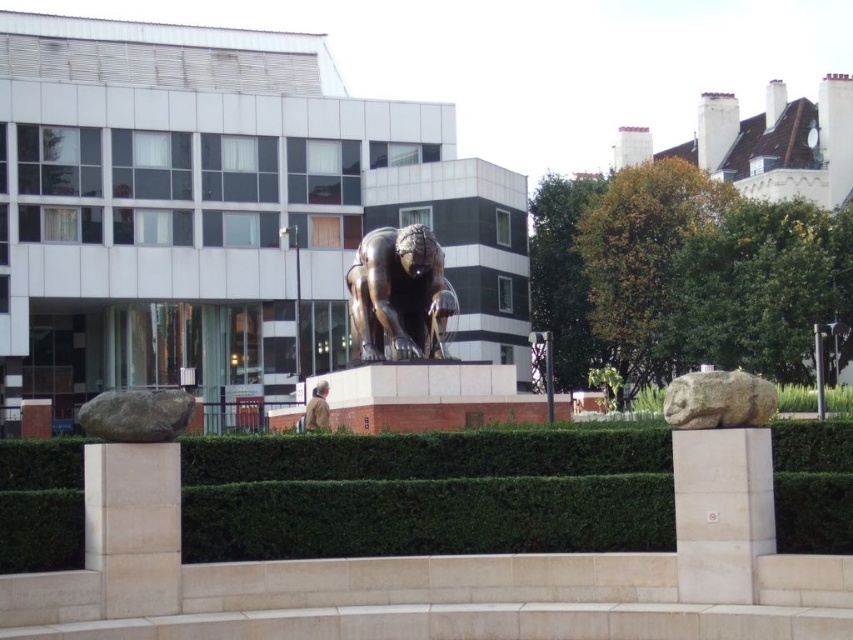
Question: Which is nearer to the green hedge at center?

Choices:
 (A) green mossy stone at center
 (B) gray rough rock at lower left
 (C) bronze statue at center
 (D) green leafy bush at upper right

Answer: (A)

Question: Among these objects, which one is farthest from the camera?

Choices:
 (A) bronze statue at center
 (B) green mossy stone at center

Answer: (A)

Question: Can you confirm if bronze statue at center is positioned below green mossy stone at center?

Choices:
 (A) no
 (B) yes

Answer: (A)

Question: Which point is closer to the camera taking this photo?

Choices:
 (A) (129, 417)
 (B) (814, 292)

Answer: (A)

Question: Observing the image, what is the correct spatial positioning of green mossy stone at center in reference to gray rough rock at lower left?

Choices:
 (A) above
 (B) below

Answer: (A)

Question: Does green hedge at center come in front of bronze statue at center?

Choices:
 (A) no
 (B) yes

Answer: (B)